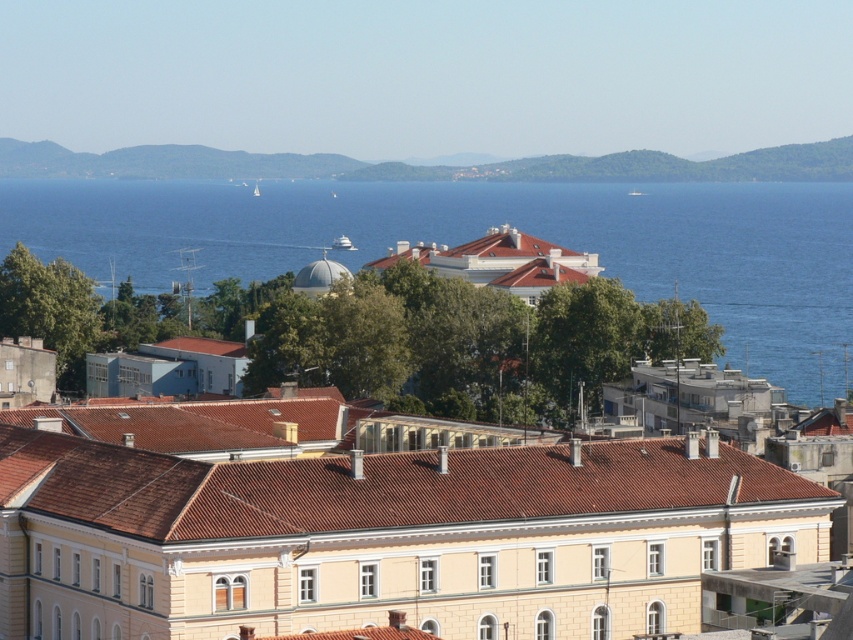
The height and width of the screenshot is (640, 853). What do you see at coordinates (376, 529) in the screenshot? I see `beige stone building at center` at bounding box center [376, 529].

Is beige stone building at center to the left of blue water at center from the viewer's perspective?

Correct, you'll find beige stone building at center to the left of blue water at center.

Describe the element at coordinates (376, 529) in the screenshot. The image size is (853, 640). I see `beige stone building at center` at that location.

Where is `beige stone building at center`? The image size is (853, 640). beige stone building at center is located at coordinates (376, 529).